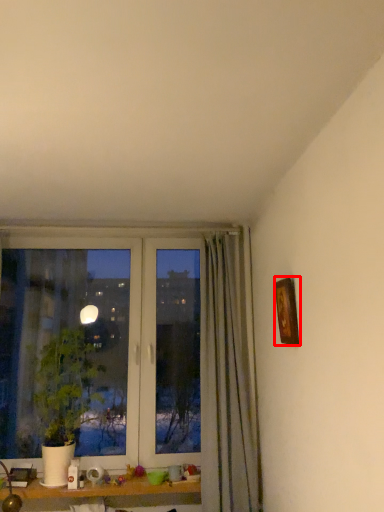
Question: From the image's perspective, where is picture frame (annotated by the red box) located relative to houseplant?

Choices:
 (A) below
 (B) above

Answer: (B)